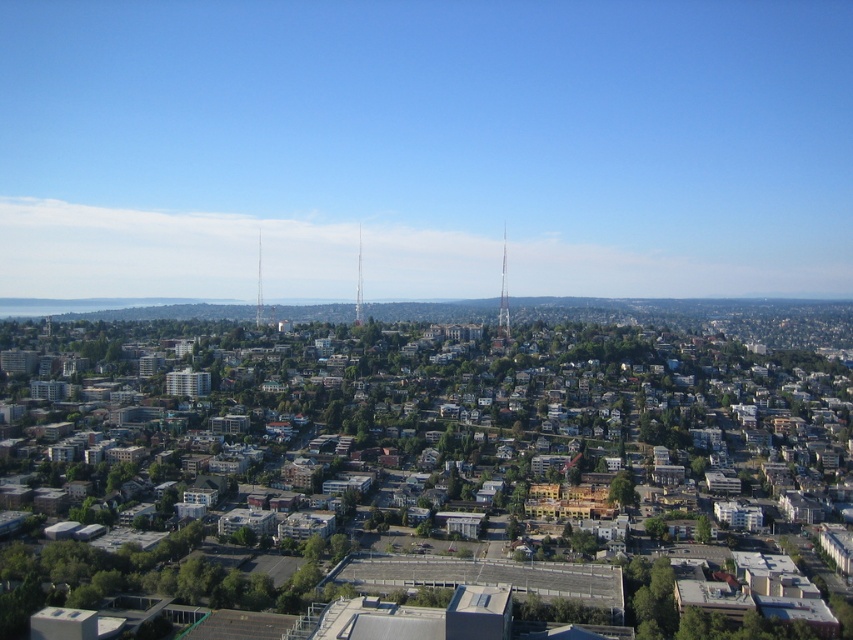
Question: Which object is the closest to the smooth glass tower at center?

Choices:
 (A) metallic silver tower at center
 (B) silver metallic tower at center

Answer: (A)

Question: Can you confirm if metallic silver tower at center is bigger than silver metallic tower at center?

Choices:
 (A) yes
 (B) no

Answer: (A)

Question: Does smooth glass tower at center have a smaller size compared to silver metallic tower at center?

Choices:
 (A) no
 (B) yes

Answer: (A)

Question: Among these objects, which one is nearest to the camera?

Choices:
 (A) smooth glass tower at center
 (B) silver metallic tower at center

Answer: (A)

Question: Is smooth glass tower at center bigger than silver metallic tower at center?

Choices:
 (A) yes
 (B) no

Answer: (A)

Question: Which point is closer to the camera taking this photo?

Choices:
 (A) (502, 305)
 (B) (256, 323)

Answer: (A)